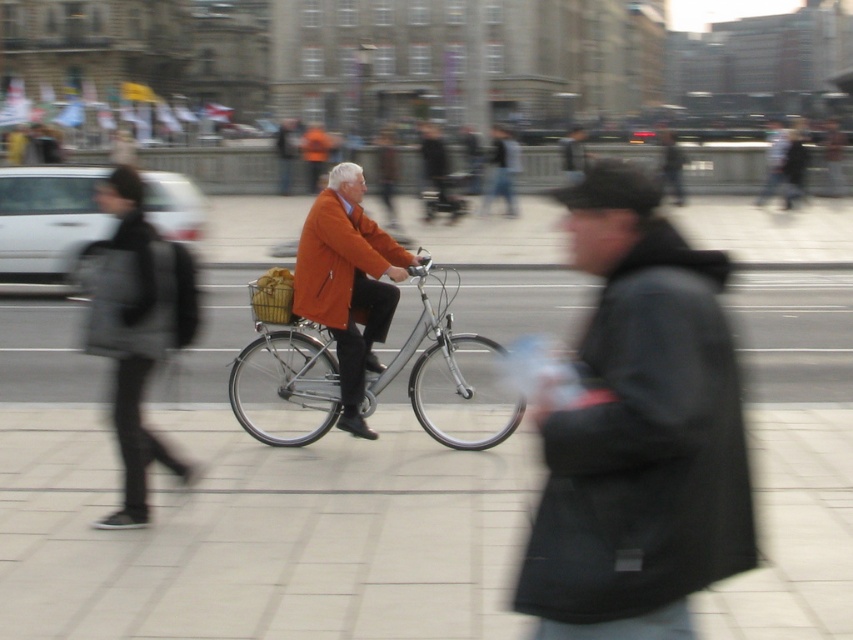
Question: Is the position of black matte jacket at lower right more distant than that of orange matte jacket at center?

Choices:
 (A) no
 (B) yes

Answer: (A)

Question: Does smooth concrete pavement at center appear over orange matte coat at center?

Choices:
 (A) yes
 (B) no

Answer: (B)

Question: Is orange matte coat at center thinner than matte black backpack at left?

Choices:
 (A) no
 (B) yes

Answer: (A)

Question: Which is farther from the smooth concrete pavement at center?

Choices:
 (A) orange matte coat at center
 (B) silver metallic bicycle at center
 (C) black matte jacket at lower right
 (D) black fabric backpack at left

Answer: (B)

Question: Which point is closer to the camera?

Choices:
 (A) (300, 451)
 (B) (444, 332)

Answer: (A)

Question: Estimate the real-world distances between objects in this image. Which object is farther from the black fabric backpack at left?

Choices:
 (A) orange matte coat at center
 (B) silver metallic bicycle at center

Answer: (B)